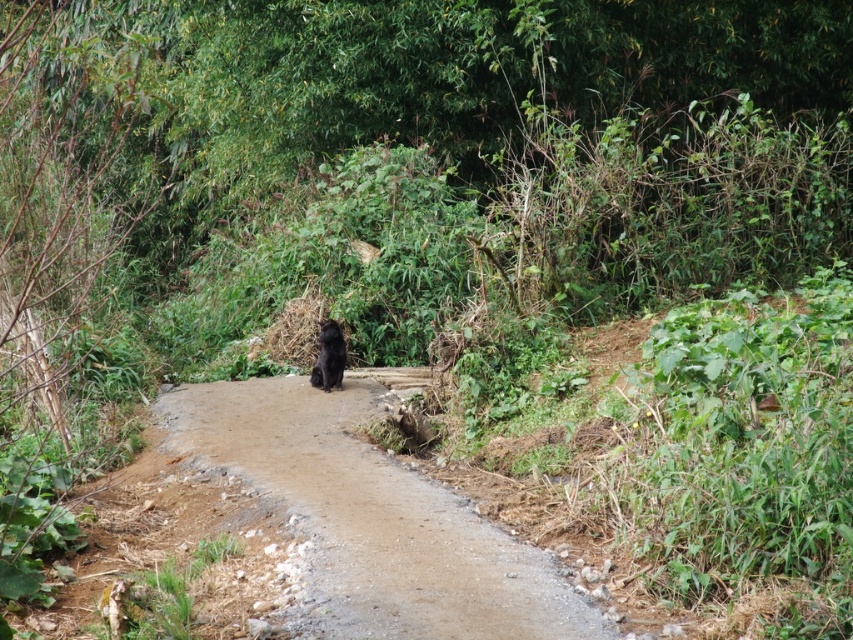
Can you confirm if dirt road at center is positioned to the left of black furry dog at center?

In fact, dirt road at center is to the right of black furry dog at center.

Describe the element at coordinates (372, 518) in the screenshot. This screenshot has width=853, height=640. I see `dirt road at center` at that location.

Find the location of `dirt road at center`. dirt road at center is located at coordinates (372, 518).